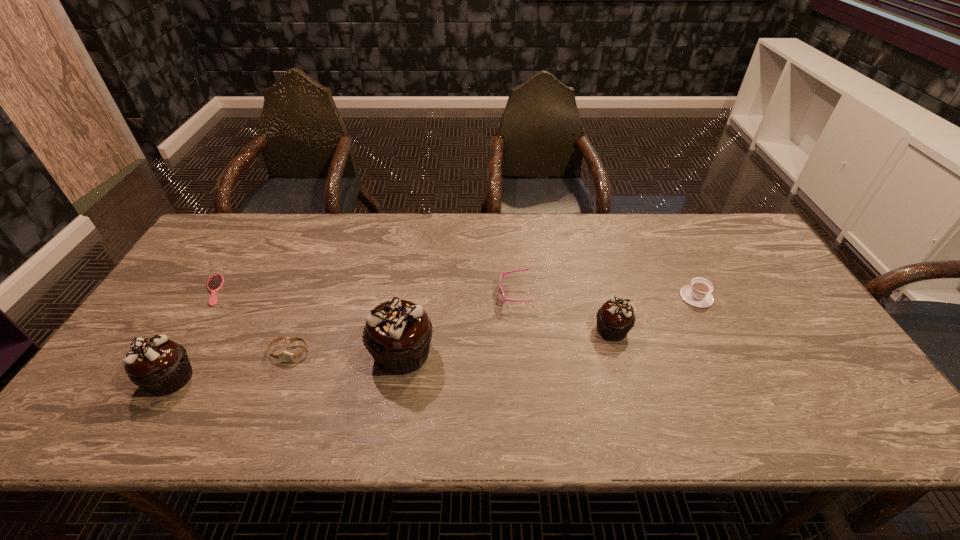
Identify the location of vacant space in between the sunglasses and the second cupcake from right to left. (458, 324).

Where is `unoccupied position between the rightmost object and the second tallest cupcake`? unoccupied position between the rightmost object and the second tallest cupcake is located at coordinates (433, 338).

Where is `unoccupied position between the hairbrush and the rightmost object`? Image resolution: width=960 pixels, height=540 pixels. unoccupied position between the hairbrush and the rightmost object is located at coordinates (455, 294).

At what (x,y) coordinates should I click in order to perform the action: click on free space between the shortest object and the tallest cupcake. Please return your answer as a coordinate pair (x, y). The height and width of the screenshot is (540, 960). Looking at the image, I should click on (308, 321).

Where is `unoccupied position between the hairbrush and the second tallest cupcake`? The height and width of the screenshot is (540, 960). unoccupied position between the hairbrush and the second tallest cupcake is located at coordinates (192, 334).

At what (x,y) coordinates should I click in order to perform the action: click on free area in between the fifth object from right to left and the fifth shortest object. Please return your answer as a coordinate pair (x, y). The height and width of the screenshot is (540, 960). Looking at the image, I should click on (450, 341).

The height and width of the screenshot is (540, 960). What are the coordinates of `vacant space in between the second object from right to left and the third object from left to right` in the screenshot? It's located at click(x=450, y=341).

Where is `empty location between the third tallest object and the second shortest object`? The width and height of the screenshot is (960, 540). empty location between the third tallest object and the second shortest object is located at coordinates (450, 341).

Locate an element on the screen. This screenshot has height=540, width=960. vacant space that is in between the tallest object and the shortest object is located at coordinates (308, 321).

Find the location of a particular element. The width and height of the screenshot is (960, 540). the fourth closest object relative to the fifth shortest object is located at coordinates (284, 356).